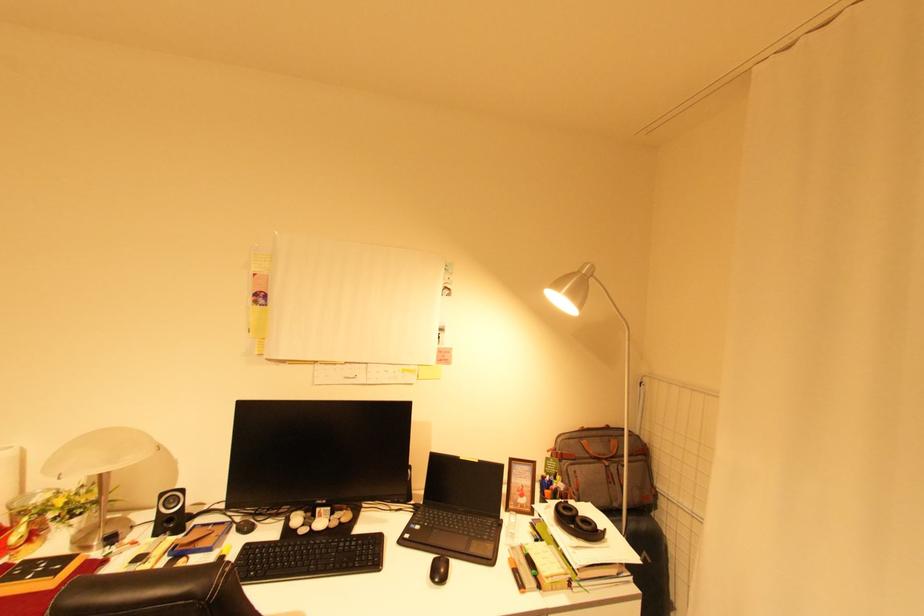
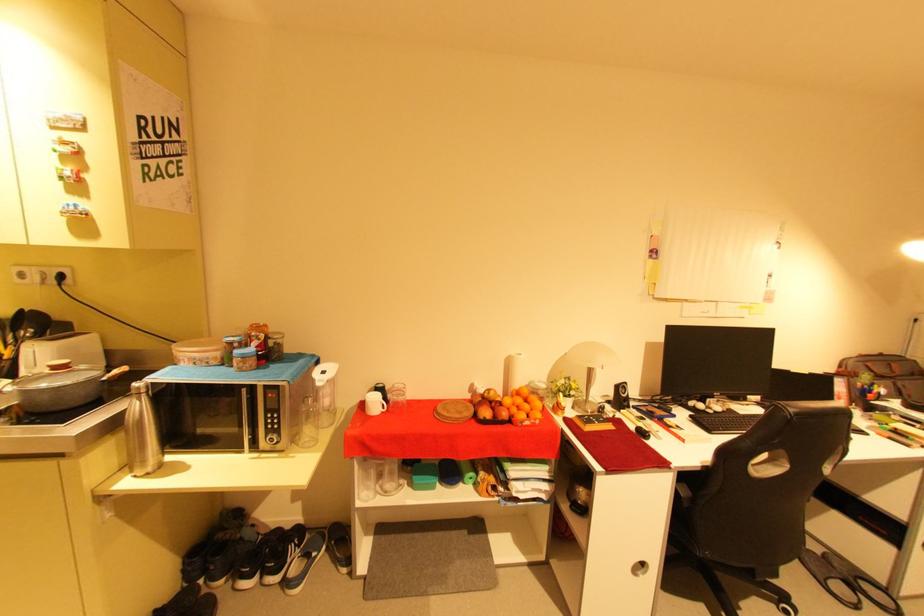
The point at (592,428) is marked in the first image. Where is the corresponding point in the second image?

(871, 354)